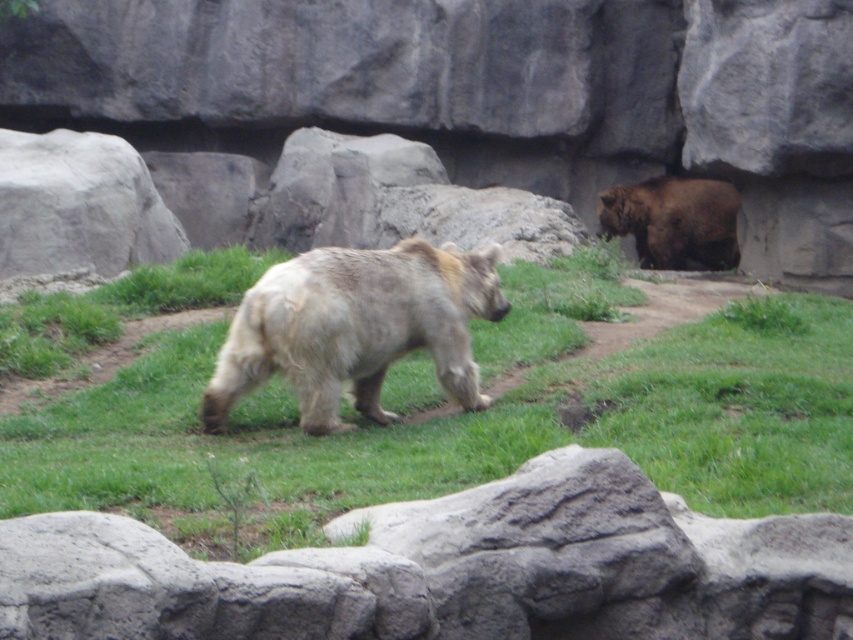
Which is behind, point (268, 460) or point (698, 228)?

Point (698, 228)

Does point (30, 432) come closer to viewer compared to point (712, 196)?

Yes, point (30, 432) is closer to viewer.

The width and height of the screenshot is (853, 640). What are the coordinates of `green grassy at center` in the screenshot? It's located at (456, 433).

Can you confirm if gray rock at center is shorter than green grassy at center?

No, gray rock at center is not shorter than green grassy at center.

Does gray rock at center have a larger size compared to green grassy at center?

Correct, gray rock at center is larger in size than green grassy at center.

Image resolution: width=853 pixels, height=640 pixels. I want to click on gray rock at center, so click(x=485, y=93).

Does gray rough rock at center have a lesser width compared to grayish-brown fur at center?

No, gray rough rock at center is not thinner than grayish-brown fur at center.

Which is in front, point (836, 540) or point (447, 362)?

Point (836, 540) is in front.

This screenshot has width=853, height=640. Find the location of `gray rough rock at center`. gray rough rock at center is located at coordinates (450, 570).